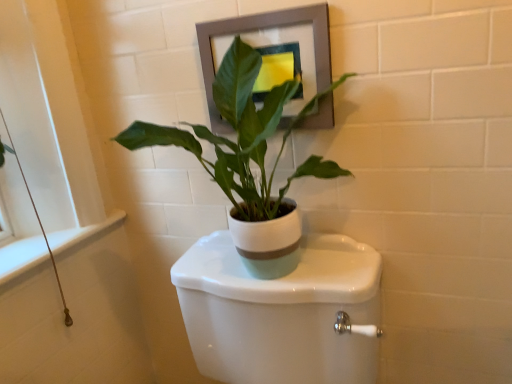
Measure the distance between matte gray picture frame at upper center and camera.

The distance of matte gray picture frame at upper center from camera is 86.90 centimeters.

Measure the distance between white matte pot at center and camera.

white matte pot at center and camera are 72.08 centimeters apart from each other.

What do you see at coordinates (248, 160) in the screenshot?
I see `white matte pot at center` at bounding box center [248, 160].

The width and height of the screenshot is (512, 384). Find the location of `white glossy toilet at center`. white glossy toilet at center is located at coordinates (280, 312).

Based on the photo, which object is wider, white glossy toilet at center or white matte pot at center?

white glossy toilet at center is wider.

Image resolution: width=512 pixels, height=384 pixels. In order to click on houseplant to the left of white glossy toilet at center in this screenshot , I will do `click(248, 160)`.

Is white glossy toilet at center at the right side of white matte pot at center?

Yes.

Is the depth of white glossy toilet at center less than that of white matte pot at center?

Yes, white glossy toilet at center is in front of white matte pot at center.

Based on the photo, from the image's perspective, would you say white matte pot at center is shown under matte gray picture frame at upper center?

Indeed, from the image's perspective, white matte pot at center is shown beneath matte gray picture frame at upper center.

Are white matte pot at center and matte gray picture frame at upper center far apart?

No, there isn't a large distance between white matte pot at center and matte gray picture frame at upper center.

How many degrees apart are the facing directions of white matte pot at center and matte gray picture frame at upper center?

0.338 degrees separate the facing orientations of white matte pot at center and matte gray picture frame at upper center.

Does white matte pot at center have a lesser width compared to matte gray picture frame at upper center?

No.

From a real-world perspective, is white matte pot at center positioned above or below white glossy toilet at center?

From a real-world perspective, white matte pot at center is physically above white glossy toilet at center.

Is white matte pot at center closer to the viewer compared to white glossy toilet at center?

No, white matte pot at center is further to the viewer.

Is white matte pot at center aimed at white glossy toilet at center?

No.

Is white matte pot at center bigger than white glossy toilet at center?

No.

Looking at this image, between matte gray picture frame at upper center and white glossy toilet at center, which one has smaller size?

matte gray picture frame at upper center is smaller.

In the scene shown: Are matte gray picture frame at upper center and white glossy toilet at center far apart?

No, matte gray picture frame at upper center is not far from white glossy toilet at center.

How much distance is there between matte gray picture frame at upper center and white glossy toilet at center?

A distance of 16.75 inches exists between matte gray picture frame at upper center and white glossy toilet at center.

In the scene shown: Does matte gray picture frame at upper center appear on the left side of white glossy toilet at center?

In fact, matte gray picture frame at upper center is to the right of white glossy toilet at center.

I want to click on picture frame above the white glossy toilet at center (from the image's perspective), so click(267, 30).

From a real-world perspective, is white glossy toilet at center located beneath matte gray picture frame at upper center?

Yes, from a real-world perspective, white glossy toilet at center is below matte gray picture frame at upper center.

Between white glossy toilet at center and matte gray picture frame at upper center, which one has smaller width?

Thinner between the two is matte gray picture frame at upper center.

From the image's perspective, is white glossy toilet at center above or below matte gray picture frame at upper center?

white glossy toilet at center is situated lower than matte gray picture frame at upper center in the image.

Is matte gray picture frame at upper center oriented towards white matte pot at center?

Yes, matte gray picture frame at upper center is facing white matte pot at center.

Considering the sizes of objects matte gray picture frame at upper center and white matte pot at center in the image provided, who is shorter, matte gray picture frame at upper center or white matte pot at center?

matte gray picture frame at upper center.

From the image's perspective, would you say matte gray picture frame at upper center is shown under white matte pot at center?

No, from the image's perspective, matte gray picture frame at upper center is not beneath white matte pot at center.

Where is `houseplant above the white glossy toilet at center (from the image's perspective)`? houseplant above the white glossy toilet at center (from the image's perspective) is located at coordinates (248, 160).

At what (x,y) coordinates should I click in order to perform the action: click on picture frame located on the right of white matte pot at center. Please return your answer as a coordinate pair (x, y). This screenshot has width=512, height=384. Looking at the image, I should click on (267, 30).

Which object lies nearer to the anchor point white matte pot at center, white glossy toilet at center or matte gray picture frame at upper center?

The object closer to white matte pot at center is matte gray picture frame at upper center.

Estimate the real-world distances between objects in this image. Which object is closer to matte gray picture frame at upper center, white matte pot at center or white glossy toilet at center?

Based on the image, white matte pot at center appears to be nearer to matte gray picture frame at upper center.

Estimate the real-world distances between objects in this image. Which object is further from white matte pot at center, matte gray picture frame at upper center or white glossy toilet at center?

white glossy toilet at center.

When comparing their distances from white glossy toilet at center, does matte gray picture frame at upper center or white matte pot at center seem closer?

The object closer to white glossy toilet at center is white matte pot at center.

Estimate the real-world distances between objects in this image. Which object is further from matte gray picture frame at upper center, white glossy toilet at center or white matte pot at center?

Among the two, white glossy toilet at center is located further to matte gray picture frame at upper center.

From the image, which object appears to be farther from white glossy toilet at center, white matte pot at center or matte gray picture frame at upper center?

matte gray picture frame at upper center is positioned further to the anchor white glossy toilet at center.

Find the location of a particular element. The image size is (512, 384). houseplant between matte gray picture frame at upper center and white glossy toilet at center in the up-down direction is located at coordinates (248, 160).